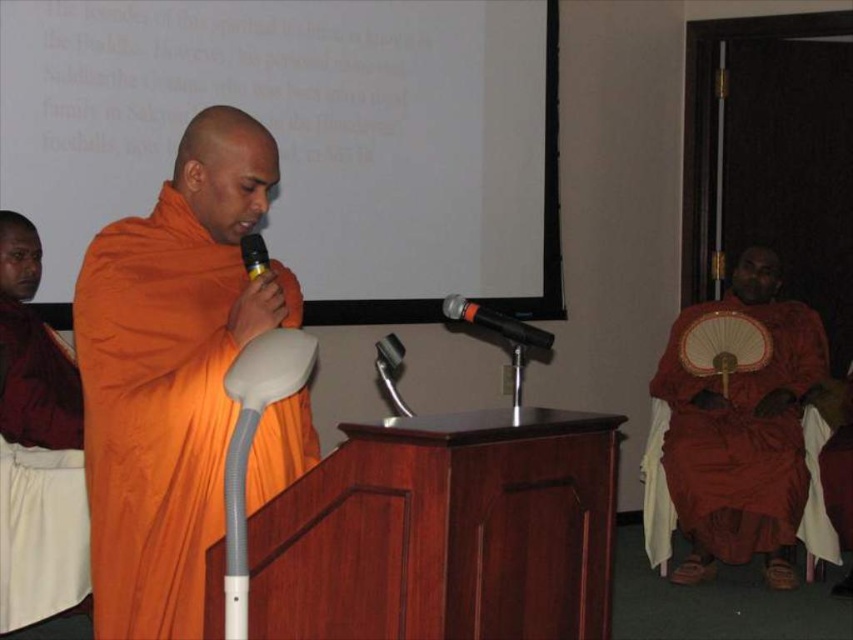
You are standing in the room and see the point marked at coordinates (738, 445). What object is located at that point?

The point at coordinates (738, 445) indicates the matte orange robe at right.

You are standing at the front of the stage and want to place a new microphone exactly at point (x=285, y=317). The stage manager says the maximum distance for the new microphone should be 8 feet from the camera. Is this point within the allowed distance?

The distance of point (x=285, y=317) from camera is 7.64 feet, which is within the 8 feet limit. Yes, this point is within the allowed distance.